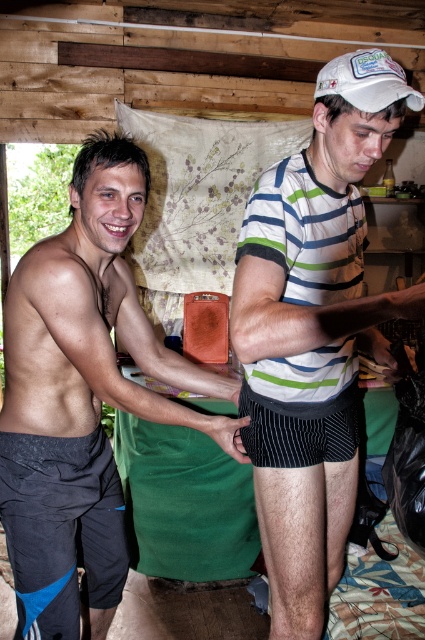
Image resolution: width=425 pixels, height=640 pixels. Describe the element at coordinates (62, 529) in the screenshot. I see `black synthetic shorts at lower left` at that location.

Does black synthetic shorts at lower left have a greater height compared to black matte hand at center?

Indeed, black synthetic shorts at lower left has a greater height compared to black matte hand at center.

Describe the element at coordinates (62, 529) in the screenshot. I see `black synthetic shorts at lower left` at that location.

The image size is (425, 640). I want to click on black synthetic shorts at lower left, so click(62, 529).

Which of these two, black synthetic shorts at lower left or white fabric baseball cap at upper right, stands shorter?

white fabric baseball cap at upper right is shorter.

Between point (115, 525) and point (360, 104), which one is positioned in front?

Point (360, 104)

Measure the distance between black synthetic shorts at lower left and camera.

black synthetic shorts at lower left is 4.48 feet from camera.

Locate an element on the screen. The image size is (425, 640). black synthetic shorts at lower left is located at coordinates (62, 529).

Measure the distance between striped cotton shirt at center and camera.

38.61 inches

From the picture: Between striped cotton shirt at center and black synthetic shorts at lower left, which one is positioned lower?

black synthetic shorts at lower left is below.

Describe the element at coordinates (314, 332) in the screenshot. I see `striped cotton shirt at center` at that location.

The image size is (425, 640). Identify the location of striped cotton shirt at center. (314, 332).